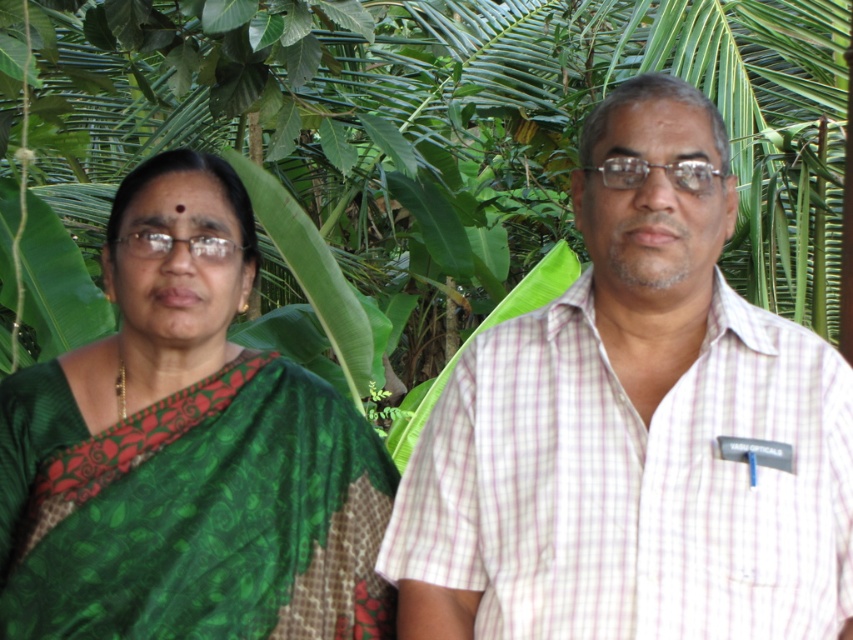
Can you confirm if white checkered shirt at right is shorter than green woven saree at left?

No.

Does white checkered shirt at right have a lesser width compared to green woven saree at left?

In fact, white checkered shirt at right might be wider than green woven saree at left.

This screenshot has height=640, width=853. What are the coordinates of `white checkered shirt at right` in the screenshot? It's located at (631, 428).